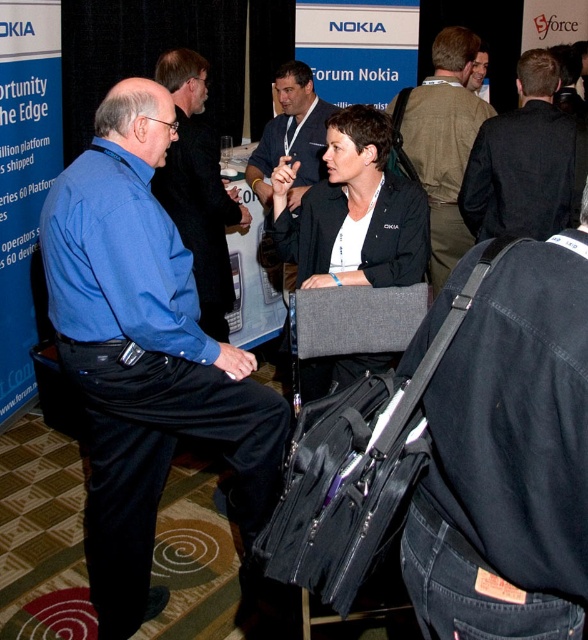
Is point (342, 275) farther from camera compared to point (225, 259)?

No.

Which is behind, point (360, 232) or point (215, 276)?

Positioned behind is point (215, 276).

This screenshot has width=588, height=640. What do you see at coordinates (353, 211) in the screenshot? I see `black fabric chair at center` at bounding box center [353, 211].

I want to click on black fabric chair at center, so click(x=353, y=211).

Describe the element at coordinates (522, 161) in the screenshot. This screenshot has height=640, width=588. I see `black leather jacket at upper right` at that location.

Is point (547, 195) farther from camera compared to point (282, 118)?

No, (547, 195) is in front of (282, 118).

Describe the element at coordinates (522, 161) in the screenshot. I see `black leather jacket at upper right` at that location.

Image resolution: width=588 pixels, height=640 pixels. Identify the location of black leather jacket at upper right. (522, 161).

In the scene shown: Between black fabric chair at center and dark blue shirt at center, which one is positioned lower?

Positioned lower is black fabric chair at center.

Is black fabric chair at center to the left of dark blue shirt at center from the viewer's perspective?

Incorrect, black fabric chair at center is not on the left side of dark blue shirt at center.

Identify the location of black fabric chair at center. This screenshot has height=640, width=588. (353, 211).